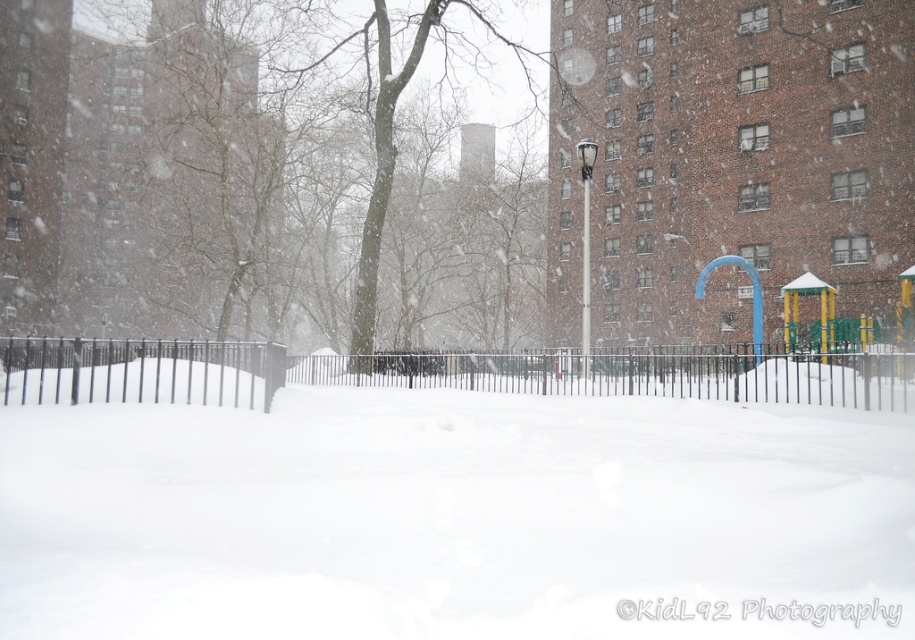
Can you confirm if white fluffy snow at center is thinner than black metal fence at center?

No, white fluffy snow at center is not thinner than black metal fence at center.

Does white fluffy snow at center appear on the right side of black metal fence at center?

Correct, you'll find white fluffy snow at center to the right of black metal fence at center.

Where is `white fluffy snow at center`? This screenshot has width=915, height=640. white fluffy snow at center is located at coordinates (449, 508).